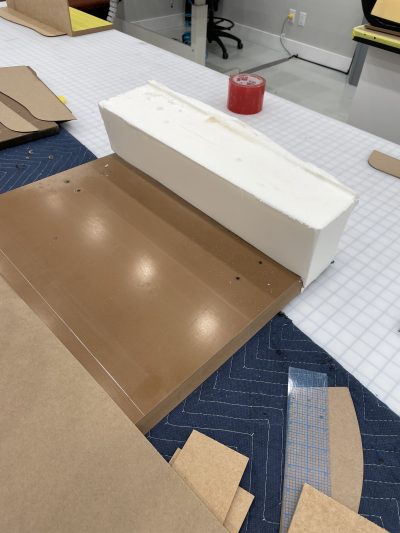
The height and width of the screenshot is (533, 400). What are the coordinates of `cutting board` in the screenshot? It's located at (144, 277).